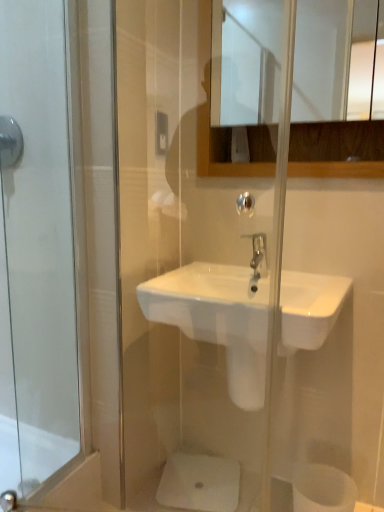
From the picture: In order to face glossy wooden mirror at upper center, should I rotate leftwards or rightwards?

Rotate your view right by about 13.832°.

The image size is (384, 512). In order to click on polished chrome faucet at center in this screenshot , I will do `click(258, 254)`.

Find the location of `glossy wooden mirror at upper center`. glossy wooden mirror at upper center is located at coordinates (338, 61).

Based on the photo, would you say glossy wooden mirror at upper center contains polished chrome faucet at center?

No, polished chrome faucet at center is not inside glossy wooden mirror at upper center.

Is glossy wooden mirror at upper center directly adjacent to polished chrome faucet at center?

glossy wooden mirror at upper center and polished chrome faucet at center are not in contact.

Considering the relative positions of glossy wooden mirror at upper center and polished chrome faucet at center in the image provided, is glossy wooden mirror at upper center in front of polished chrome faucet at center?

Yes.

Who is taller, white ceramic sink at center or white matte toilet paper at lower right?

With more height is white matte toilet paper at lower right.

From a real-world perspective, is white ceramic sink at center physically located above or below white matte toilet paper at lower right?

Clearly, from a real-world perspective, white ceramic sink at center is above white matte toilet paper at lower right.

Which is behind, white ceramic sink at center or white matte toilet paper at lower right?

white matte toilet paper at lower right is further from the camera.

Is brushed metal shower at upper left at the left side of polished chrome faucet at center?

Indeed, brushed metal shower at upper left is positioned on the left side of polished chrome faucet at center.

Can you confirm if brushed metal shower at upper left is thinner than polished chrome faucet at center?

Correct, the width of brushed metal shower at upper left is less than that of polished chrome faucet at center.

From a real-world perspective, who is located lower, brushed metal shower at upper left or polished chrome faucet at center?

From a 3D spatial view, polished chrome faucet at center is below.

From a real-world perspective, is polished chrome faucet at center below white matte toilet paper at lower right?

No, from a real-world perspective, polished chrome faucet at center is not under white matte toilet paper at lower right.

Is polished chrome faucet at center thinner than white matte toilet paper at lower right?

Indeed, polished chrome faucet at center has a lesser width compared to white matte toilet paper at lower right.

Based on their positions, is polished chrome faucet at center located to the left or right of white matte toilet paper at lower right?

In the image, polished chrome faucet at center appears on the left side of white matte toilet paper at lower right.

Which object is further away from the camera taking this photo, polished chrome faucet at center or white matte toilet paper at lower right?

polished chrome faucet at center is behind.

In terms of height, does white matte toilet paper at lower right look taller or shorter compared to polished chrome faucet at center?

In the image, white matte toilet paper at lower right appears to be taller than polished chrome faucet at center.

Who is bigger, white matte toilet paper at lower right or polished chrome faucet at center?

With larger size is white matte toilet paper at lower right.

Between white matte toilet paper at lower right and polished chrome faucet at center, which one is positioned in front?

white matte toilet paper at lower right is more forward.

How distant is white matte toilet paper at lower right from polished chrome faucet at center?

white matte toilet paper at lower right is 89.50 centimeters away from polished chrome faucet at center.

Identify the location of sink below the polished chrome faucet at center (from the image's perspective). click(x=218, y=319).

Is polished chrome faucet at center taller than white ceramic sink at center?

In fact, polished chrome faucet at center may be shorter than white ceramic sink at center.

Which object is closer to the camera taking this photo, polished chrome faucet at center or white ceramic sink at center?

Positioned in front is white ceramic sink at center.

Can you tell me how much polished chrome faucet at center and white ceramic sink at center differ in facing direction?

The angle between the facing direction of polished chrome faucet at center and the facing direction of white ceramic sink at center is 0.1 degrees.

Is white ceramic sink at center far away from brushed metal shower at upper left?

Actually, white ceramic sink at center and brushed metal shower at upper left are a little close together.

In terms of size, does white ceramic sink at center appear bigger or smaller than brushed metal shower at upper left?

white ceramic sink at center is bigger than brushed metal shower at upper left.

Which is behind, white ceramic sink at center or brushed metal shower at upper left?

brushed metal shower at upper left is further away from the camera.

Where is `mirror on the right of polished chrome faucet at center`? This screenshot has width=384, height=512. mirror on the right of polished chrome faucet at center is located at coordinates click(338, 61).

The width and height of the screenshot is (384, 512). Find the location of `sink in front of the white matte toilet paper at lower right`. sink in front of the white matte toilet paper at lower right is located at coordinates (218, 319).

Based on their spatial positions, is white ceramic sink at center or polished chrome faucet at center further from glossy wooden mirror at upper center?

The object further to glossy wooden mirror at upper center is polished chrome faucet at center.

Which object lies nearer to the anchor point polished chrome faucet at center, brushed metal shower at upper left or glossy wooden mirror at upper center?

Among the two, brushed metal shower at upper left is located nearer to polished chrome faucet at center.

Which object lies further to the anchor point polished chrome faucet at center, white matte toilet paper at lower right or white ceramic sink at center?

white matte toilet paper at lower right lies further to polished chrome faucet at center than the other object.

Looking at the image, which one is located closer to brushed metal shower at upper left, polished chrome faucet at center or white matte toilet paper at lower right?

polished chrome faucet at center is positioned closer to the anchor brushed metal shower at upper left.

Estimate the real-world distances between objects in this image. Which object is closer to polished chrome faucet at center, glossy wooden mirror at upper center or white ceramic sink at center?

white ceramic sink at center is positioned closer to the anchor polished chrome faucet at center.

Which object lies further to the anchor point polished chrome faucet at center, white matte toilet paper at lower right or brushed metal shower at upper left?

white matte toilet paper at lower right is positioned further to the anchor polished chrome faucet at center.

From the image, which object appears to be farther from glossy wooden mirror at upper center, brushed metal shower at upper left or white ceramic sink at center?

Among the two, brushed metal shower at upper left is located further to glossy wooden mirror at upper center.

Based on their spatial positions, is glossy wooden mirror at upper center or white matte toilet paper at lower right closer to polished chrome faucet at center?

white matte toilet paper at lower right.

In order to click on sink between polished chrome faucet at center and white matte toilet paper at lower right in the vertical direction in this screenshot , I will do `click(218, 319)`.

I want to click on tap that lies between glossy wooden mirror at upper center and white ceramic sink at center from top to bottom, so click(x=258, y=254).

The width and height of the screenshot is (384, 512). I want to click on tap between glossy wooden mirror at upper center and white matte toilet paper at lower right from top to bottom, so click(258, 254).

The image size is (384, 512). I want to click on tap that lies between brushed metal shower at upper left and white matte toilet paper at lower right from top to bottom, so click(258, 254).